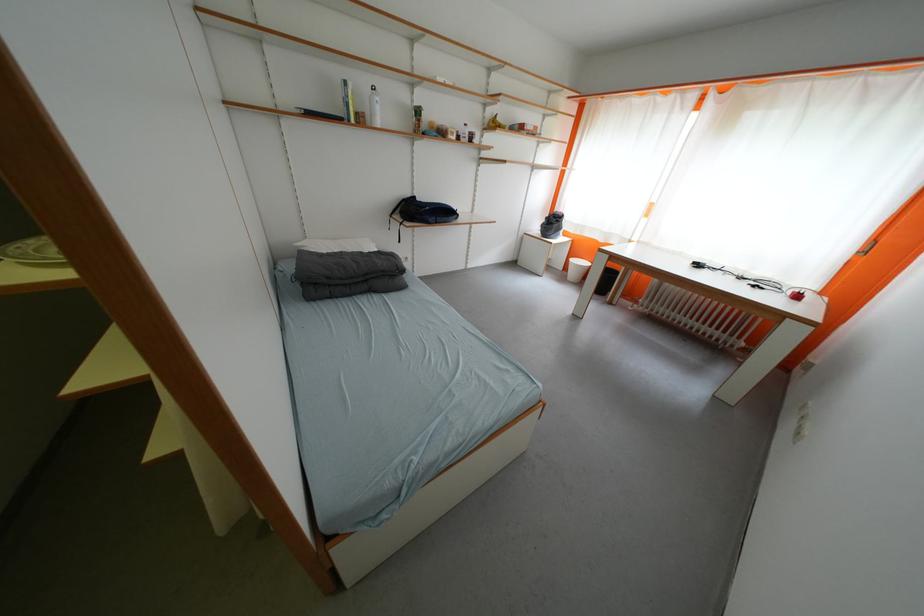
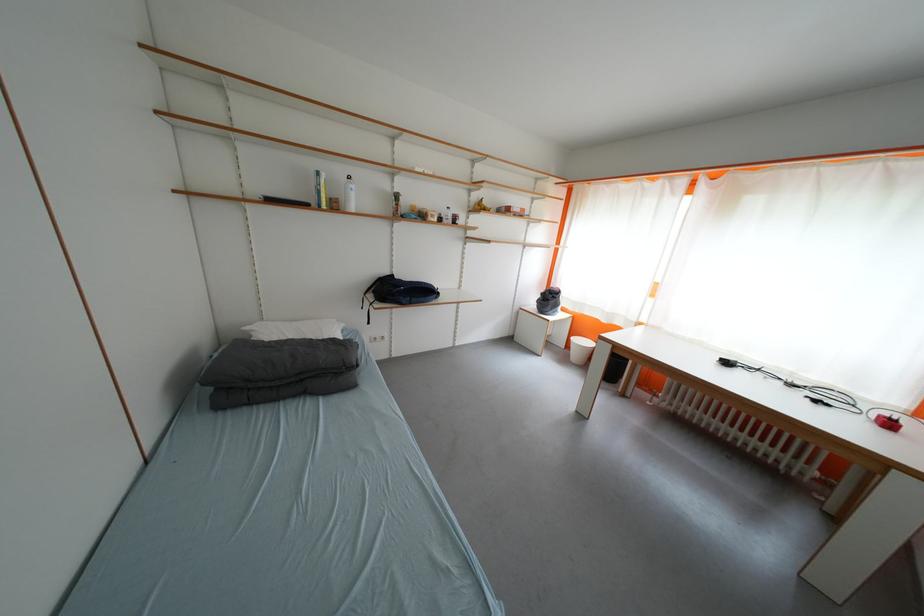
The point at [371,124] is marked in the first image. Where is the corresponding point in the second image?

(344, 209)